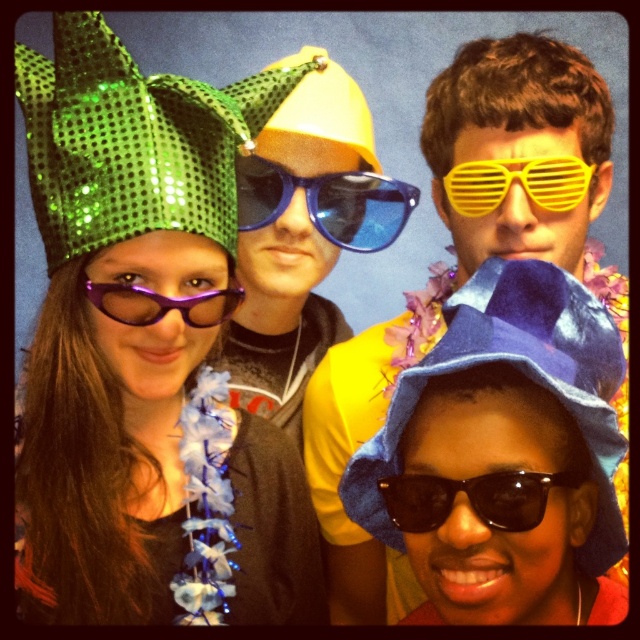
Is matte purple sunglasses at upper left below yellow plastic sunglasses at upper center?

Yes.

Image resolution: width=640 pixels, height=640 pixels. What do you see at coordinates (141, 362) in the screenshot? I see `matte purple sunglasses at upper left` at bounding box center [141, 362].

The width and height of the screenshot is (640, 640). Identify the location of matte purple sunglasses at upper left. (141, 362).

This screenshot has height=640, width=640. I want to click on black plastic sunglasses at lower center, so click(x=472, y=499).

Which is in front, point (490, 513) or point (467, 180)?

Positioned in front is point (490, 513).

This screenshot has width=640, height=640. I want to click on black plastic sunglasses at lower center, so click(x=472, y=499).

Is green sequined hat at upper left taller than purple matte goggles at left?

Yes, green sequined hat at upper left is taller than purple matte goggles at left.

From the picture: Between green sequined hat at upper left and purple matte goggles at left, which one is positioned lower?

purple matte goggles at left

Describe the element at coordinates (128, 141) in the screenshot. I see `green sequined hat at upper left` at that location.

Where is `green sequined hat at upper left`? green sequined hat at upper left is located at coordinates (128, 141).